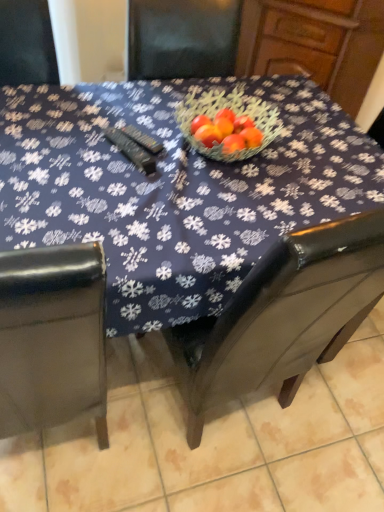
This screenshot has width=384, height=512. What do you see at coordinates (214, 442) in the screenshot?
I see `brown leather chair at lower right` at bounding box center [214, 442].

Locate an element on the screen. brown leather chair at lower right is located at coordinates (214, 442).

What do you see at coordinates (174, 189) in the screenshot?
I see `blue fabric table at center` at bounding box center [174, 189].

Find the location of a particular element. The height and width of the screenshot is (512, 384). blue fabric table at center is located at coordinates (174, 189).

At what (x,y) coordinates should I click in order to perform the action: click on brown leather chair at lower right. Please return your answer as a coordinate pair (x, y). The image size is (384, 512). Looking at the image, I should click on (214, 442).

Considering the relative positions of blue fabric table at center and brown leather chair at lower right in the image provided, is blue fabric table at center to the right of brown leather chair at lower right from the viewer's perspective?

No.

Which object is more forward, blue fabric table at center or brown leather chair at lower right?

blue fabric table at center.

Which is less distant, (x=80, y=125) or (x=169, y=369)?

Point (x=80, y=125).

From the image's perspective, is blue fabric table at center positioned above or below brown leather chair at lower right?

blue fabric table at center is above brown leather chair at lower right.

From a real-world perspective, does blue fabric table at center sit lower than brown leather chair at lower right?

No, from a real-world perspective, blue fabric table at center is not beneath brown leather chair at lower right.

From the picture: Which of these two, blue fabric table at center or brown leather chair at lower right, is wider?

brown leather chair at lower right is wider.

Considering the relative sizes of blue fabric table at center and brown leather chair at lower right in the image provided, is blue fabric table at center shorter than brown leather chair at lower right?

In fact, blue fabric table at center may be taller than brown leather chair at lower right.

Considering the relative sizes of blue fabric table at center and brown leather chair at lower right in the image provided, is blue fabric table at center smaller than brown leather chair at lower right?

No.

Is blue fabric table at center outside of brown leather chair at lower right?

blue fabric table at center lies outside brown leather chair at lower right's area.

Is blue fabric table at center far away from brown leather chair at lower right?

blue fabric table at center is near brown leather chair at lower right, not far away.

Does blue fabric table at center turn towards brown leather chair at lower right?

No, blue fabric table at center is not oriented towards brown leather chair at lower right.

Can you tell me how much blue fabric table at center and brown leather chair at lower right differ in facing direction?

There is a 0.12-degree angle between the facing directions of blue fabric table at center and brown leather chair at lower right.

Where is `tile below the blue fabric table at center (from a real-world perspective)`? The width and height of the screenshot is (384, 512). tile below the blue fabric table at center (from a real-world perspective) is located at coordinates (214, 442).

Considering the relative positions of brown leather chair at lower right and blue fabric table at center in the image provided, is brown leather chair at lower right to the left or to the right of blue fabric table at center?

In the image, brown leather chair at lower right appears on the right side of blue fabric table at center.

Relative to blue fabric table at center, is brown leather chair at lower right in front or behind?

brown leather chair at lower right is behind blue fabric table at center.

Is point (92, 485) closer to viewer compared to point (103, 84)?

Yes.

From the image's perspective, is brown leather chair at lower right beneath blue fabric table at center?

Yes.

From a real-world perspective, is brown leather chair at lower right physically above blue fabric table at center?

No, from a real-world perspective, brown leather chair at lower right is not above blue fabric table at center.

Considering the sizes of brown leather chair at lower right and blue fabric table at center in the image, is brown leather chair at lower right wider or thinner than blue fabric table at center?

In the image, brown leather chair at lower right appears to be wider than blue fabric table at center.

Can you confirm if brown leather chair at lower right is shorter than blue fabric table at center?

Yes.

Considering the relative sizes of brown leather chair at lower right and blue fabric table at center in the image provided, is brown leather chair at lower right smaller than blue fabric table at center?

Yes.

From the picture: Is brown leather chair at lower right not inside blue fabric table at center?

Yes, brown leather chair at lower right is located beyond the bounds of blue fabric table at center.

Are brown leather chair at lower right and blue fabric table at center beside each other?

No, brown leather chair at lower right is not touching blue fabric table at center.

Is brown leather chair at lower right looking in the opposite direction of blue fabric table at center?

No, brown leather chair at lower right is not facing away from blue fabric table at center.

In order to click on tile below the blue fabric table at center (from the image's perspective) in this screenshot , I will do `click(214, 442)`.

In order to click on table above the brown leather chair at lower right (from a real-world perspective) in this screenshot , I will do `click(174, 189)`.

Where is `table above the brown leather chair at lower right (from the image's perspective)`? This screenshot has height=512, width=384. table above the brown leather chair at lower right (from the image's perspective) is located at coordinates pos(174,189).